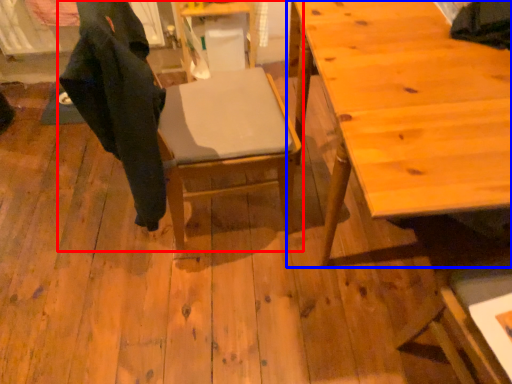
Question: Which point is closer to the camera, chair (highlighted by a red box) or table (highlighted by a blue box)?

Choices:
 (A) chair
 (B) table

Answer: (B)